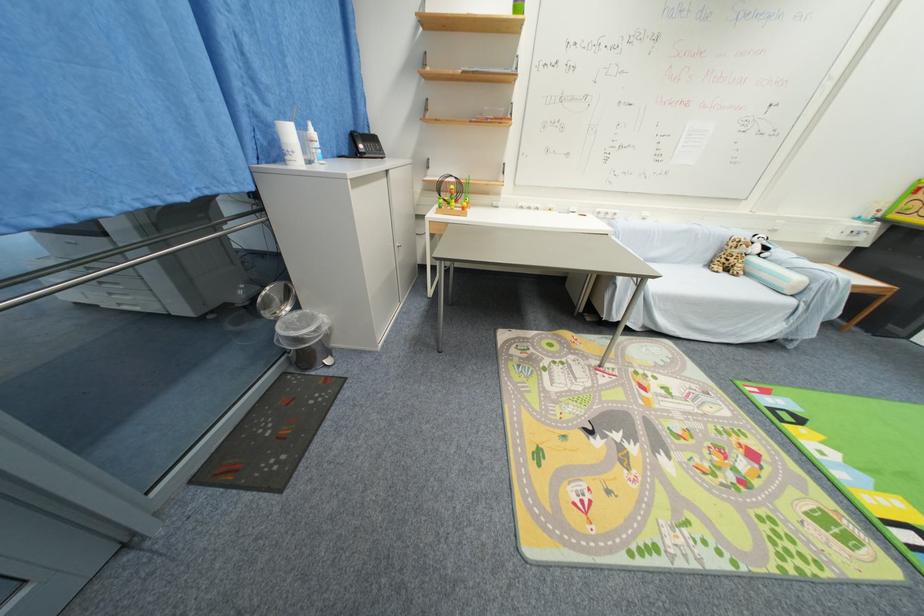
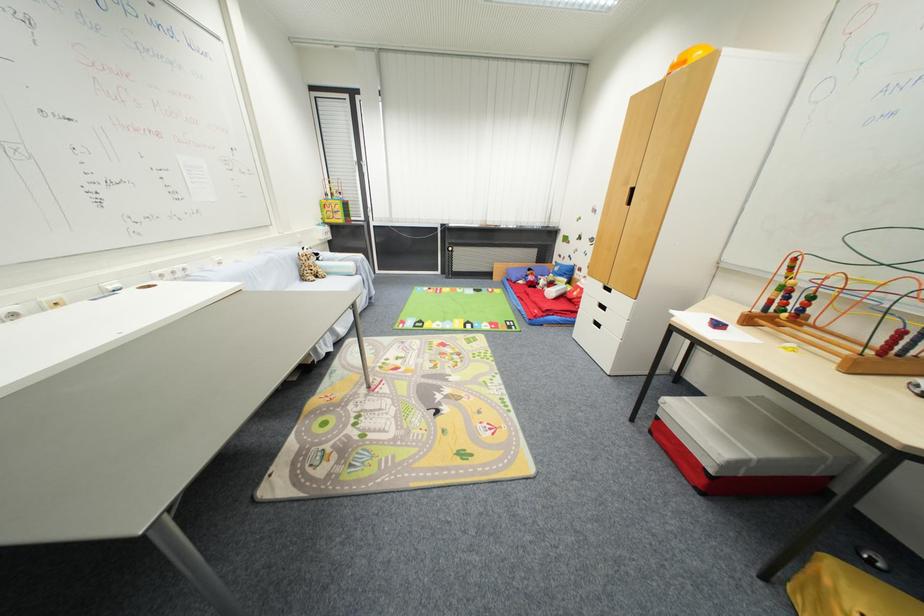
The point at (731, 264) is marked in the first image. Where is the corresponding point in the second image?

(313, 274)